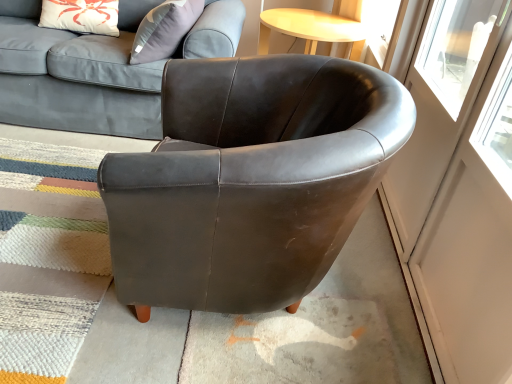
Locate an element on the screen. This screenshot has width=512, height=384. transparent glass screen door at right is located at coordinates (458, 195).

What is the approximate height of transparent glass screen door at right?

The height of transparent glass screen door at right is 38.81 inches.

Locate an element on the screen. This screenshot has height=384, width=512. matte brown leather armchair at center is located at coordinates (250, 180).

The image size is (512, 384). What do you see at coordinates (77, 75) in the screenshot?
I see `matte gray fabric couch at upper left` at bounding box center [77, 75].

At what (x,y) coordinates should I click in order to perform the action: click on transparent glass screen door at right. Please return your answer as a coordinate pair (x, y). Image resolution: width=512 pixels, height=384 pixels. Looking at the image, I should click on (458, 195).

Is matte brown leather armchair at center in front of matte gray fabric couch at upper left?

Yes, matte brown leather armchair at center is closer to the viewer.

Is there a large distance between matte brown leather armchair at center and matte gray fabric couch at upper left?

matte brown leather armchair at center is actually quite close to matte gray fabric couch at upper left.

How much distance is there between matte brown leather armchair at center and matte gray fabric couch at upper left?

matte brown leather armchair at center is 35.62 inches from matte gray fabric couch at upper left.

Is matte gray fabric couch at upper left spatially inside matte brown leather armchair at center, or outside of it?

matte gray fabric couch at upper left is not enclosed by matte brown leather armchair at center.

Which of these two, matte gray fabric couch at upper left or matte brown leather armchair at center, stands shorter?

matte brown leather armchair at center.

Which object is closer to the camera, matte gray fabric couch at upper left or matte brown leather armchair at center?

matte brown leather armchair at center is closer to the camera.

Find the location of `chair that is on the right side of matte gray fabric couch at upper left`. chair that is on the right side of matte gray fabric couch at upper left is located at coordinates (250, 180).

Who is taller, matte gray fabric couch at upper left or transparent glass screen door at right?

transparent glass screen door at right is taller.

Does matte gray fabric couch at upper left appear on the left side of transparent glass screen door at right?

Yes, matte gray fabric couch at upper left is to the left of transparent glass screen door at right.

From the image's perspective, is matte gray fabric couch at upper left above or below transparent glass screen door at right?

From the image's perspective, matte gray fabric couch at upper left appears above transparent glass screen door at right.

Is transparent glass screen door at right not inside matte brown leather armchair at center?

That's correct, transparent glass screen door at right is outside of matte brown leather armchair at center.

Which object is more forward, transparent glass screen door at right or matte brown leather armchair at center?

transparent glass screen door at right is in front.

Considering the points (408, 213) and (196, 280), which point is in front, point (408, 213) or point (196, 280)?

Point (196, 280)

Identify the location of chair that is above the transparent glass screen door at right (from the image's perspective). This screenshot has height=384, width=512. (250, 180).

Is transparent glass screen door at right inside or outside of matte gray fabric couch at upper left?

transparent glass screen door at right is spatially situated outside matte gray fabric couch at upper left.

Does transparent glass screen door at right turn towards matte gray fabric couch at upper left?

No.

Considering the relative sizes of transparent glass screen door at right and matte gray fabric couch at upper left in the image provided, is transparent glass screen door at right smaller than matte gray fabric couch at upper left?

Yes.

Is matte brown leather armchair at center oriented away from transparent glass screen door at right?

Yes, transparent glass screen door at right is at the back of matte brown leather armchair at center.

Considering the sizes of objects matte brown leather armchair at center and transparent glass screen door at right in the image provided, who is wider, matte brown leather armchair at center or transparent glass screen door at right?

Wider between the two is matte brown leather armchair at center.

From a real-world perspective, is matte brown leather armchair at center physically located above or below transparent glass screen door at right?

Clearly, from a real-world perspective, matte brown leather armchair at center is below transparent glass screen door at right.

I want to click on chair below the matte gray fabric couch at upper left (from the image's perspective), so click(x=250, y=180).

What are the coordinates of `chair on the right of the matte gray fabric couch at upper left` in the screenshot? It's located at (250, 180).

From the image, which object appears to be farther from transparent glass screen door at right, matte brown leather armchair at center or matte gray fabric couch at upper left?

matte gray fabric couch at upper left is positioned further to the anchor transparent glass screen door at right.

Looking at the image, which one is located further to matte gray fabric couch at upper left, transparent glass screen door at right or matte brown leather armchair at center?

The object further to matte gray fabric couch at upper left is transparent glass screen door at right.

Based on their spatial positions, is transparent glass screen door at right or matte gray fabric couch at upper left further from matte brown leather armchair at center?

matte gray fabric couch at upper left lies further to matte brown leather armchair at center than the other object.

Which object lies further to the anchor point transparent glass screen door at right, matte gray fabric couch at upper left or matte brown leather armchair at center?

The object further to transparent glass screen door at right is matte gray fabric couch at upper left.

Which object lies further to the anchor point matte gray fabric couch at upper left, matte brown leather armchair at center or transparent glass screen door at right?

The object further to matte gray fabric couch at upper left is transparent glass screen door at right.

Looking at the image, which one is located further to matte brown leather armchair at center, matte gray fabric couch at upper left or transparent glass screen door at right?

Based on the image, matte gray fabric couch at upper left appears to be further to matte brown leather armchair at center.

The height and width of the screenshot is (384, 512). Identify the location of chair between matte gray fabric couch at upper left and transparent glass screen door at right from left to right. (250, 180).